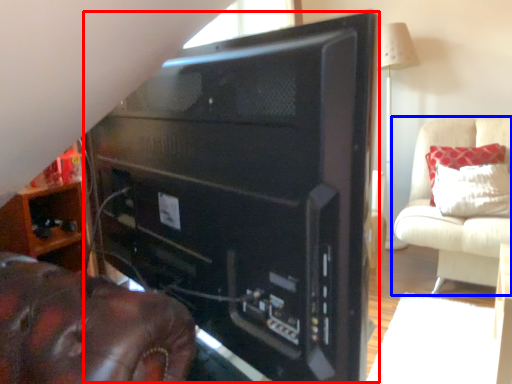
Question: Which object appears farthest to the camera in this image, desktop computer (highlighted by a red box) or furniture (highlighted by a blue box)?

Choices:
 (A) desktop computer
 (B) furniture

Answer: (B)